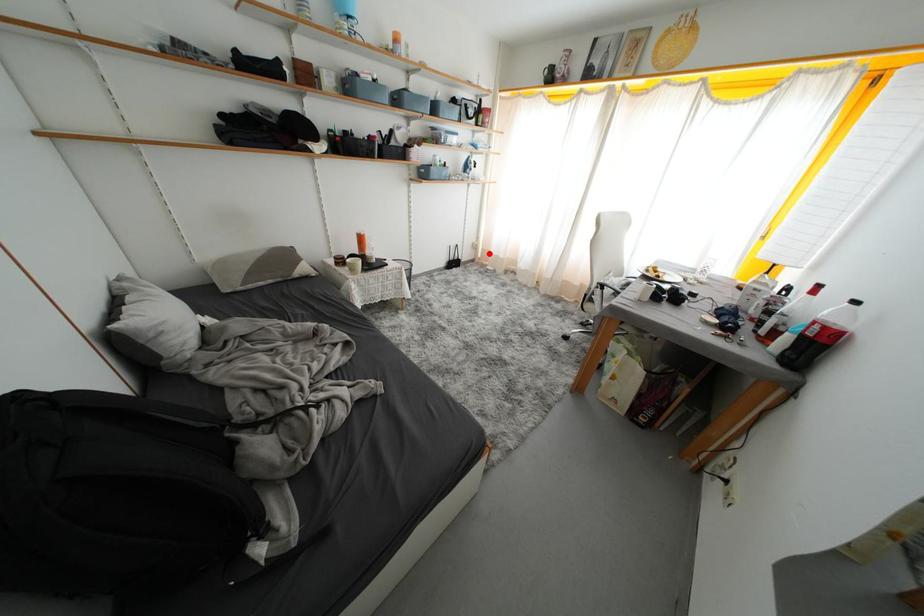
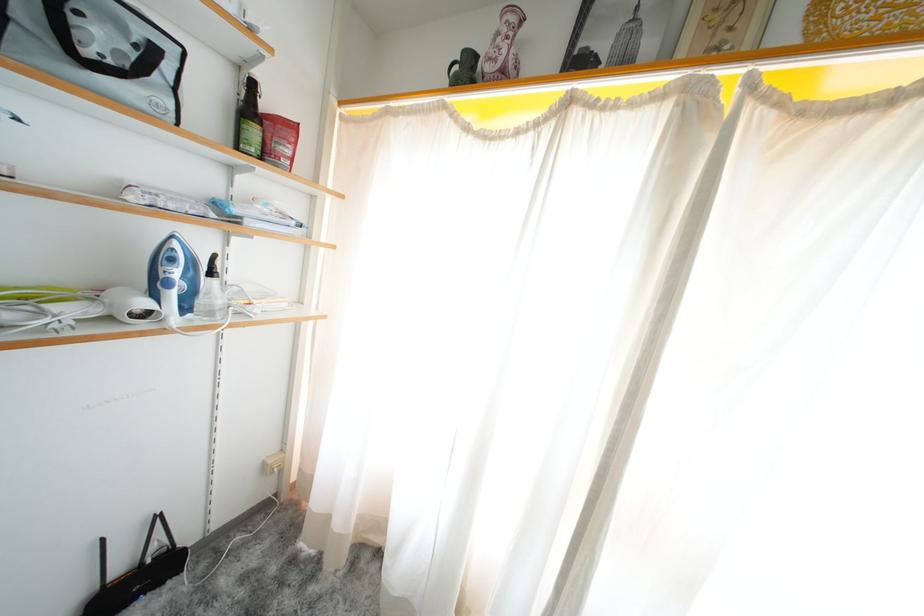
Question: I am providing you with two images of the same scene from different viewpoints. Image1 has a red point marked. In image2, the corresponding 3D location appears at what relative position? Reply with the corresponding letter.

Choices:
 (A) Closer
 (B) Farther

Answer: (B)